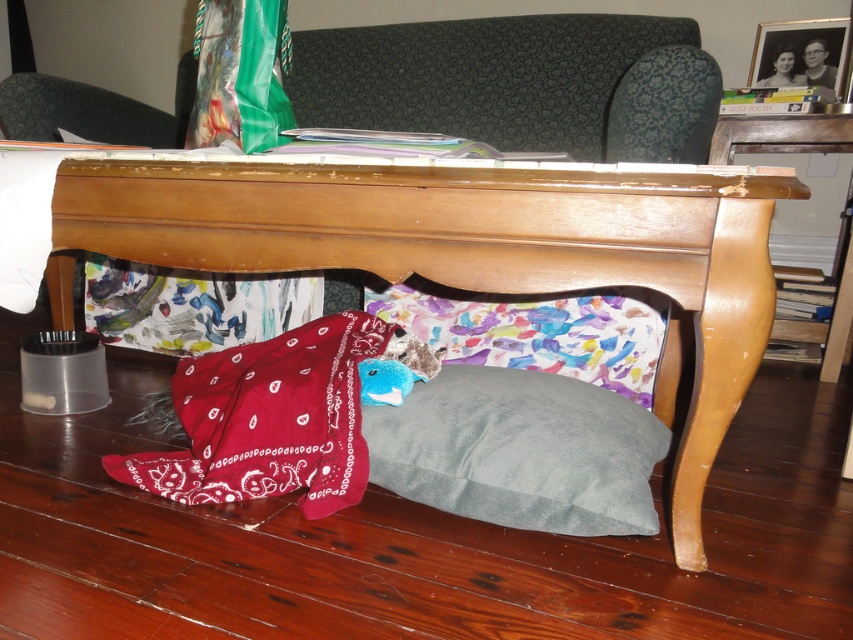
Question: Does red bandana at lower center have a lesser width compared to glossy wood side table at lower right?

Choices:
 (A) yes
 (B) no

Answer: (B)

Question: Which point is closer to the camera taking this photo?

Choices:
 (A) (631, 353)
 (B) (318, 228)
 (C) (581, 506)

Answer: (C)

Question: Does red bandana at lower center appear under green plastic bag at upper center?

Choices:
 (A) yes
 (B) no

Answer: (A)

Question: Is wooden table at lower center smaller than watercolor fabric pillow at under table?

Choices:
 (A) yes
 (B) no

Answer: (B)

Question: Considering the real-world distances, which object is closest to the glossy wood side table at lower right?

Choices:
 (A) wooden table at lower center
 (B) gray velvety pillow at lower center

Answer: (B)

Question: Among these objects, which one is farthest from the camera?

Choices:
 (A) green plastic bag at upper center
 (B) wooden table at lower center

Answer: (A)